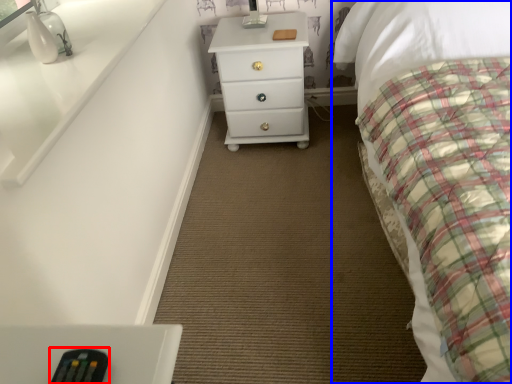
Question: Which object is further to the camera taking this photo, remote (highlighted by a red box) or bed (highlighted by a blue box)?

Choices:
 (A) remote
 (B) bed

Answer: (A)